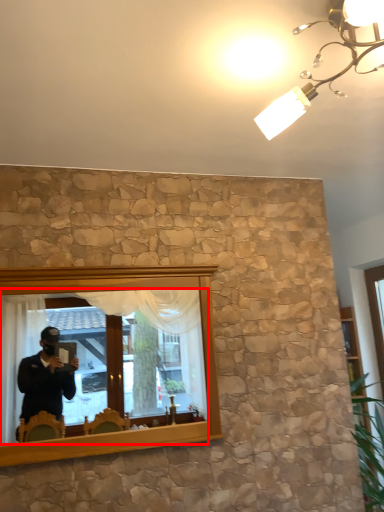
Question: In this image, where is mirror (annotated by the red box) located relative to light fixture?

Choices:
 (A) left
 (B) right

Answer: (A)